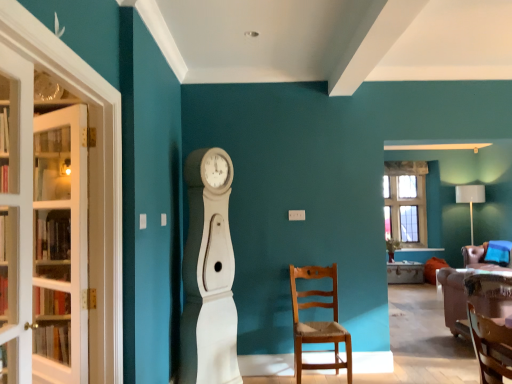
You are a GUI agent. You are given a task and a screenshot of the screen. Output one action in this format:
    pyautogui.click(x=<x>, y=<y>)
    Task: Click on the vacant space that is to the left of velvet brown sofa at lower right
    
    Given the screenshot: What is the action you would take?
    pyautogui.click(x=424, y=346)